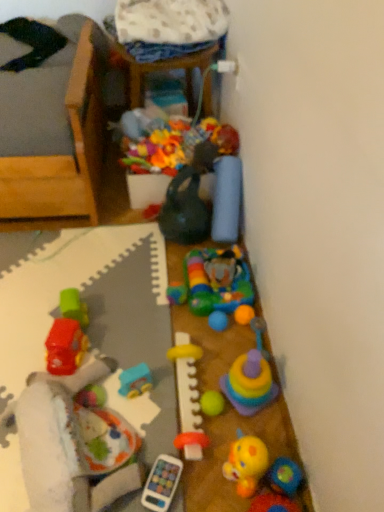
At what (x,y) coordinates should I click in order to perform the action: click on free region under yellow rubber teething ring at center, positioned as the eighth toy in right-to-left order (from a real-world perspective). Please return your answer as a coordinate pair (x, y). Image resolution: width=384 pixels, height=512 pixels. Looking at the image, I should click on click(190, 397).